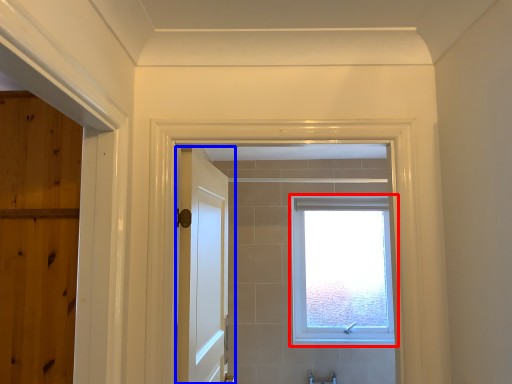
Question: Which object appears farthest to the camera in this image, window (highlighted by a red box) or door (highlighted by a blue box)?

Choices:
 (A) window
 (B) door

Answer: (A)